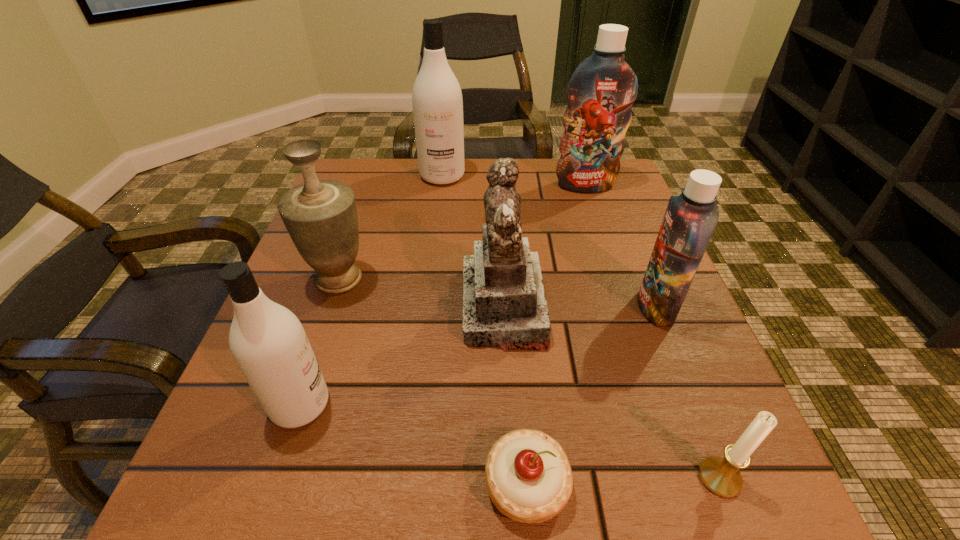
What are the coordinates of `beige pastry` in the screenshot? It's located at (529, 479).

The height and width of the screenshot is (540, 960). What are the coordinates of `the shortest object` in the screenshot? It's located at (529, 479).

You are a GUI agent. You are given a task and a screenshot of the screen. Output one action in this format:
    pyautogui.click(x=<x>, y=<y>)
    Task: Click on the free region located on the front-facing side of the second shampoo from left to right
    
    Given the screenshot: What is the action you would take?
    pyautogui.click(x=431, y=268)

I want to click on free space located on the front label of the farther blue shampoo, so click(599, 226).

Locate an element on the screen. vacant space located 0.310m on the front-facing side of the figurine is located at coordinates (293, 307).

I want to click on vacant space located on the front-facing side of the figurine, so click(x=282, y=307).

You are a GUI agent. You are given a task and a screenshot of the screen. Output one action in this format:
    pyautogui.click(x=<x>, y=<y>)
    Task: Click on the vacant region located on the front-facing side of the figurine
    
    Given the screenshot: What is the action you would take?
    pyautogui.click(x=331, y=307)

Locate an element on the screen. The width and height of the screenshot is (960, 540). free space located 0.180m on the back of the urn is located at coordinates (364, 208).

Locate an element on the screen. This screenshot has height=540, width=960. vacant region located on the front label of the smaller blue shampoo is located at coordinates (545, 307).

The height and width of the screenshot is (540, 960). Identify the location of free point located 0.170m on the front label of the smaller blue shampoo. (545, 307).